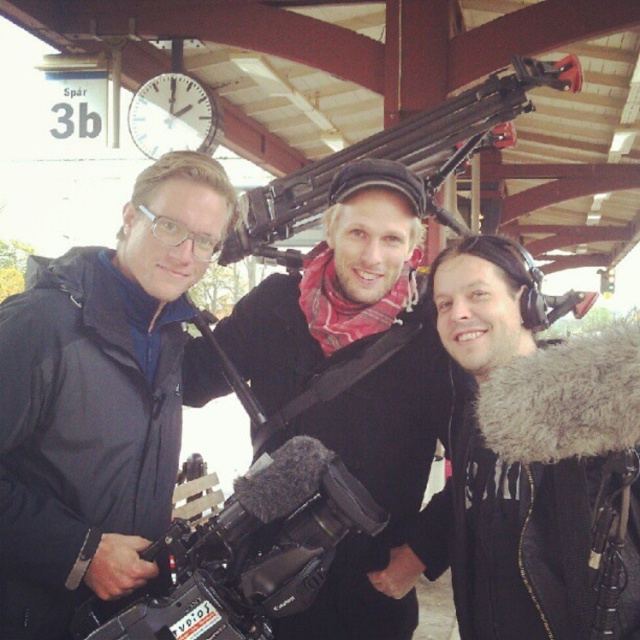
Is black matte camera at center thinner than black matte video camera at center?

No.

Between point (342, 442) and point (253, 570), which one is positioned behind?

Point (342, 442)

This screenshot has width=640, height=640. Find the location of `black matte camera at center`. black matte camera at center is located at coordinates (353, 378).

Does black matte jacket at left lie in front of matte black machine gun at center?

Yes.

Which is in front, point (93, 458) or point (244, 230)?

Positioned in front is point (93, 458).

Locate an element on the screen. The height and width of the screenshot is (640, 640). black matte jacket at left is located at coordinates (99, 397).

Does black matte jacket at left come in front of black matte video camera at center?

No.

Does point (20, 362) come closer to viewer compared to point (260, 541)?

Yes, it is.

Find the location of a particular element. black matte jacket at left is located at coordinates (99, 397).